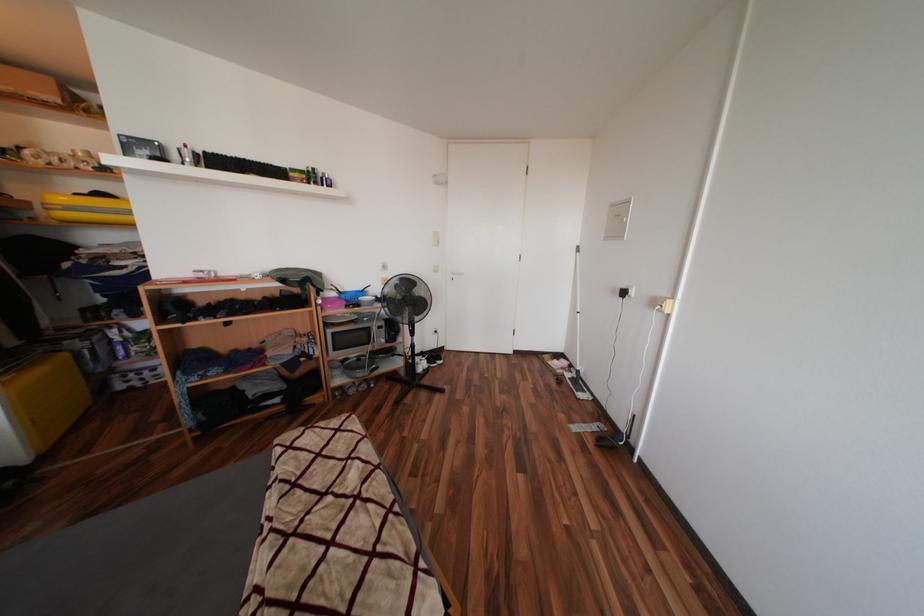
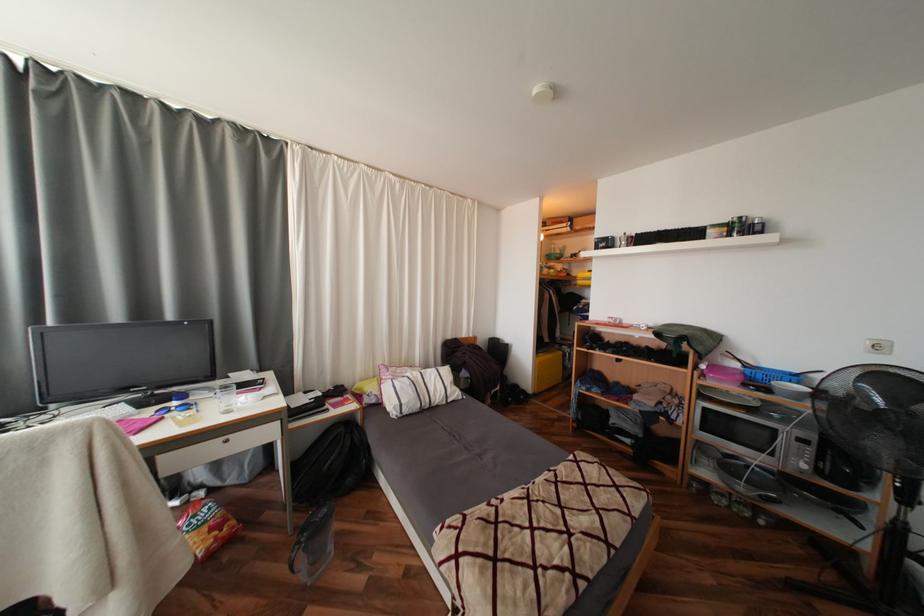
Question: The camera is either moving clockwise (left) or counter-clockwise (right) around the object. The first image is from the beginning of the video and the second image is from the end. Is the camera moving left or right when shooting the video?

Choices:
 (A) Left
 (B) Right

Answer: (B)